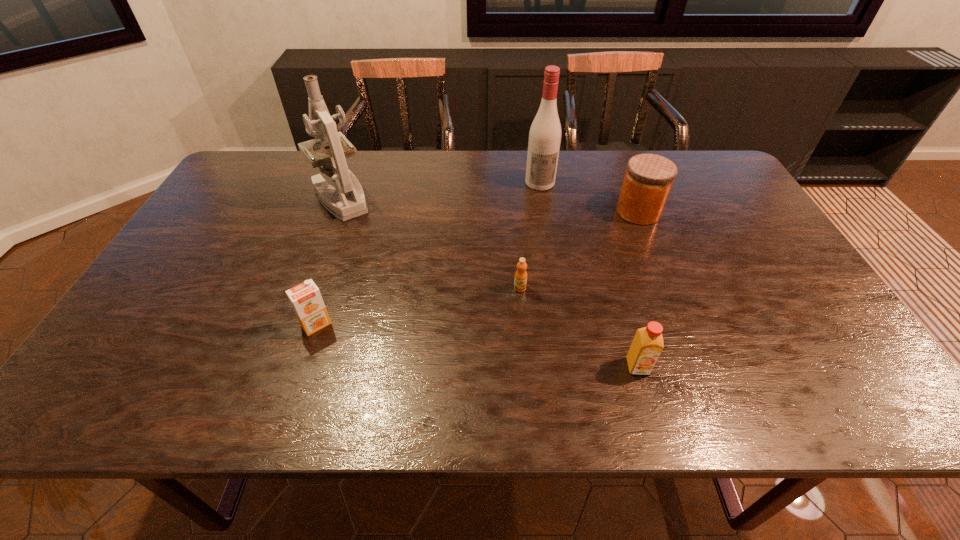
Find the location of a particular element. free space at the right edge of the desktop is located at coordinates (757, 288).

What are the coordinates of `free location at the near left corner of the desktop` in the screenshot? It's located at (99, 397).

This screenshot has height=540, width=960. In order to click on vacant region at the far right corner of the desktop in this screenshot , I will do `click(696, 159)`.

This screenshot has height=540, width=960. What are the coordinates of `free spot between the rightmost object and the third object from right to left` in the screenshot? It's located at (589, 197).

Image resolution: width=960 pixels, height=540 pixels. Identify the location of free space between the microscope and the alcohol. (441, 190).

You are a GUI agent. You are given a task and a screenshot of the screen. Output one action in this format:
    pyautogui.click(x=<x>, y=<y>)
    Task: Click on the free spot between the third object from left to right and the rightmost orange juice
    
    Given the screenshot: What is the action you would take?
    pyautogui.click(x=579, y=327)

The height and width of the screenshot is (540, 960). In order to click on vacant space that's between the third nearest object and the rightmost orange juice in this screenshot , I will do `click(579, 327)`.

Identify the location of free space between the third object from right to left and the microscope. (441, 190).

I want to click on vacant area that lies between the third nearest object and the alcohol, so click(x=530, y=235).

Where is `free spot between the rightmost object and the fourth object from left to right`? Image resolution: width=960 pixels, height=540 pixels. free spot between the rightmost object and the fourth object from left to right is located at coordinates (589, 197).